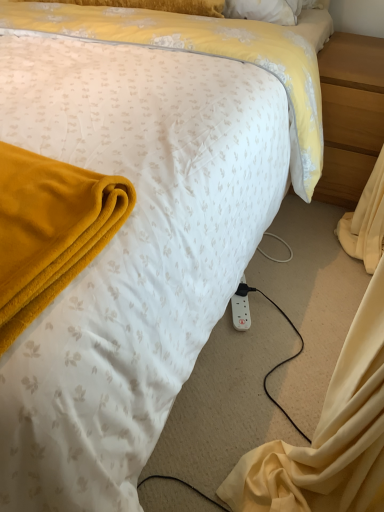
The width and height of the screenshot is (384, 512). I want to click on free space in front of white plastic power outlet at lower right, so click(x=252, y=346).